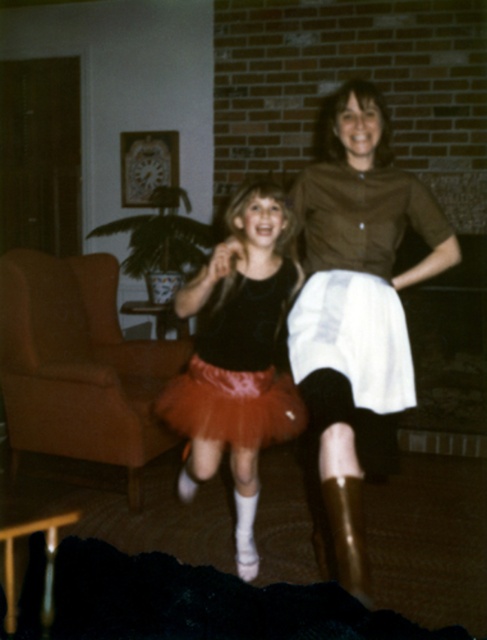
Based on the photo, you are taking a photo of two points in a room. The first point is labeled as point (351, 404) and the second is point (347, 509). Based on their positions in the image, which point is closer to the camera?

Point (351, 404) is further to the camera than point (347, 509), so the point closer to the camera is point (347, 509).

You are organizing a fashion show and need to decide which skirt takes up more horizontal space when worn. Based on the image, which skirt between the brown matte skirt at center and the matte pink tulle skirt at center is wider?

The brown matte skirt at center is wider than the matte pink tulle skirt at center according to the description.